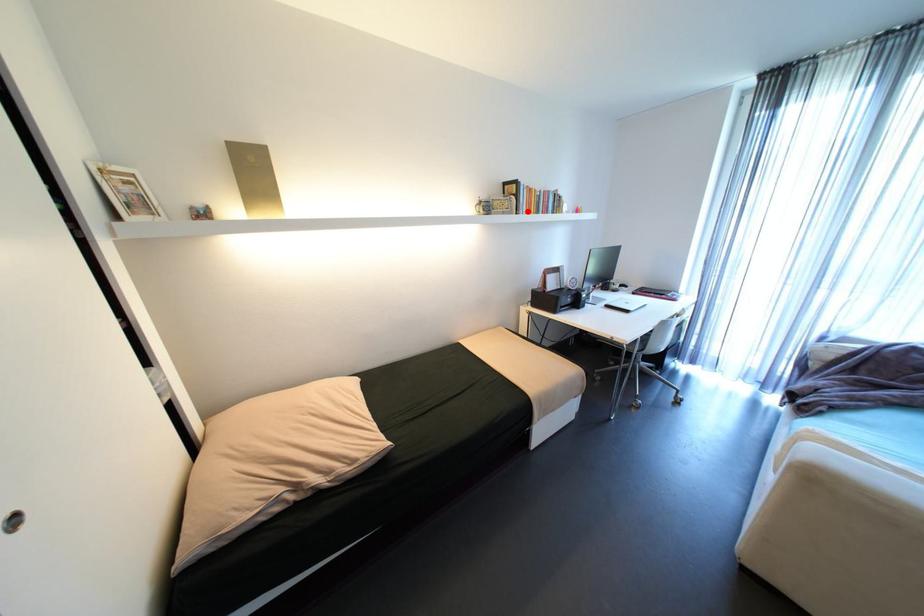
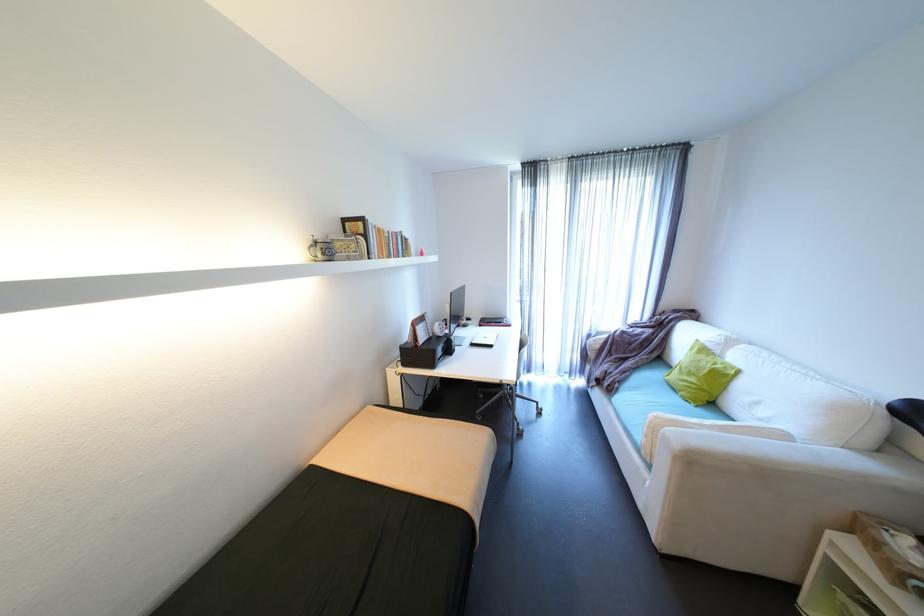
Where in the second image is the point corresponding to the highlighted location from the first image?

(380, 254)